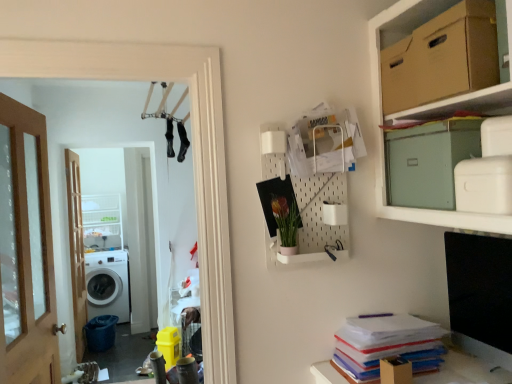
Image resolution: width=512 pixels, height=384 pixels. I want to click on matte green cardboard box at upper right, which is counted as the 1th cardboard box, starting from the bottom, so click(429, 161).

Measure the distance between brown cardboard box at upper right, arranged as the 2th cardboard box when ordered from the bottom, and camera.

brown cardboard box at upper right, arranged as the 2th cardboard box when ordered from the bottom, and camera are 4.15 feet apart.

Describe the element at coordinates (76, 250) in the screenshot. The image size is (512, 384). I see `brown wooden door at left, positioned as the first door in left-to-right order` at that location.

Measure the distance between point (78, 316) and camera.

The distance of point (78, 316) from camera is 12.55 feet.

I want to click on white glossy washing machine at left, so click(108, 284).

This screenshot has width=512, height=384. I want to click on wooden door at left, the 2th door when ordered from left to right, so click(26, 250).

Describe the element at coordinates (26, 250) in the screenshot. I see `wooden door at left, the 2th door when ordered from left to right` at that location.

What do you see at coordinates (192, 148) in the screenshot?
I see `white glossy laundry machine at left` at bounding box center [192, 148].

In order to click on matte green cardboard box at upper right, which is counted as the 1th cardboard box, starting from the bottom in this screenshot , I will do `click(429, 161)`.

Find the location of a particular element. door that is the 1st one when counting downward from the white plastic cabinet at left (from the image's perspective) is located at coordinates (26, 250).

Is wooden door at left, placed as the 1th door when sorted from front to back, far away from white plastic cabinet at left?

wooden door at left, placed as the 1th door when sorted from front to back, is far away from white plastic cabinet at left.

Is white plastic cabinet at left at the back of wooden door at left, the 1th door viewed from the right?

No, wooden door at left, the 1th door viewed from the right, is not facing the opposite direction of white plastic cabinet at left.

Which is closer, (98, 252) or (290, 227)?

Point (98, 252) is farther from the camera than point (290, 227).

Is white glossy washing machine at left bigger or smaller than green matte plant at upper center?

Clearly, white glossy washing machine at left is larger in size than green matte plant at upper center.

Can we say white glossy washing machine at left lies outside green matte plant at upper center?

That's correct, white glossy washing machine at left is outside of green matte plant at upper center.

Would you consider white glossy washing machine at left to be distant from green matte plant at upper center?

That's right, there is a large distance between white glossy washing machine at left and green matte plant at upper center.

From their relative heights in the image, would you say white plastic cabinet at left is taller or shorter than white glossy washing machine at left?

Considering their sizes, white plastic cabinet at left has less height than white glossy washing machine at left.

From a real-world perspective, relative to white glossy washing machine at left, is white plastic cabinet at left vertically above or below?

From a real-world perspective, white plastic cabinet at left is physically above white glossy washing machine at left.

At what (x,y) coordinates should I click in order to perform the action: click on washing machine that appears below the white plastic cabinet at left (from the image's perspective). Please return your answer as a coordinate pair (x, y). The image size is (512, 384). Looking at the image, I should click on (108, 284).

Does white plastic cabinet at left have a greater width compared to white glossy washing machine at left?

No.

How different are the orientations of matte green cardboard box at upper right, which is counted as the 1th cardboard box, starting from the bottom, and brown wooden door at left, placed as the 2th door when sorted from front to back, in degrees?

178 degrees.

From the image's perspective, would you say matte green cardboard box at upper right, which is the second cardboard box from top to bottom, is positioned over brown wooden door at left, placed as the 2th door when sorted from front to back?

Result: Indeed, from the image's perspective, matte green cardboard box at upper right, which is the second cardboard box from top to bottom, is shown above brown wooden door at left, placed as the 2th door when sorted from front to back.

Is matte green cardboard box at upper right, which is the second cardboard box from top to bottom, inside or outside of brown wooden door at left, positioned as the first door in left-to-right order?

matte green cardboard box at upper right, which is the second cardboard box from top to bottom, is outside brown wooden door at left, positioned as the first door in left-to-right order.

In terms of size, does matte green cardboard box at upper right, which is counted as the 1th cardboard box, starting from the bottom, appear bigger or smaller than brown wooden door at left, the 1th door when ordered from back to front?

matte green cardboard box at upper right, which is counted as the 1th cardboard box, starting from the bottom, is smaller than brown wooden door at left, the 1th door when ordered from back to front.

From the image's perspective, does white glossy laundry machine at left appear lower than brown wooden door at left, placed as the second door when sorted from right to left?

Incorrect, from the image's perspective, white glossy laundry machine at left is higher than brown wooden door at left, placed as the second door when sorted from right to left.

This screenshot has width=512, height=384. There is a white glossy laundry machine at left. In order to click on the 2nd door below it (from the image's perspective) in this screenshot , I will do `click(76, 250)`.

From a real-world perspective, relative to brown wooden door at left, the 1th door when ordered from back to front, is white glossy laundry machine at left vertically above or below?

white glossy laundry machine at left is situated higher than brown wooden door at left, the 1th door when ordered from back to front, in the real world.

Is point (113, 196) in front of point (204, 134)?

No, (113, 196) is further to viewer.

From a real-world perspective, is white plastic cabinet at left physically above white glossy laundry machine at left?

No.

Considering the relative positions of white plastic cabinet at left and white glossy laundry machine at left in the image provided, is white plastic cabinet at left to the left of white glossy laundry machine at left from the viewer's perspective?

Yes.

Could you tell me if white plastic cabinet at left is facing white glossy laundry machine at left?

Yes, white plastic cabinet at left is oriented towards white glossy laundry machine at left.

From the image's perspective, which object appears higher, white glossy washing machine at left or brown wooden door at left, placed as the 2th door when sorted from front to back?

brown wooden door at left, placed as the 2th door when sorted from front to back, from the image's perspective.

What's the angular difference between white glossy washing machine at left and brown wooden door at left, placed as the 2th door when sorted from front to back,'s facing directions?

They differ by 90 degrees in their facing directions.

Is white glossy washing machine at left closer to the viewer compared to brown wooden door at left, the 1th door when ordered from back to front?

No, the depth of white glossy washing machine at left is greater than that of brown wooden door at left, the 1th door when ordered from back to front.

From a real-world perspective, is white glossy washing machine at left located higher than brown wooden door at left, the 1th door when ordered from back to front?

No, from a real-world perspective, white glossy washing machine at left is not above brown wooden door at left, the 1th door when ordered from back to front.

Where is `cabinet lying on the left of wooden door at left, the 2th door when ordered from left to right`? cabinet lying on the left of wooden door at left, the 2th door when ordered from left to right is located at coordinates (102, 222).

Where is `plant above the white glossy washing machine at left (from the image's perspective)`? plant above the white glossy washing machine at left (from the image's perspective) is located at coordinates (286, 219).

Estimate the real-world distances between objects in this image. Which object is closer to white glossy washing machine at left, brown cardboard box at upper right, positioned as the 1th cardboard box in top-to-bottom order, or matte green cardboard box at upper right, which is counted as the 1th cardboard box, starting from the bottom?

The object closer to white glossy washing machine at left is matte green cardboard box at upper right, which is counted as the 1th cardboard box, starting from the bottom.

Which object lies further to the anchor point green matte plant at upper center, matte green cardboard box at upper right, which is counted as the 1th cardboard box, starting from the bottom, or white glossy washing machine at left?

white glossy washing machine at left is positioned further to the anchor green matte plant at upper center.

Based on their spatial positions, is matte green cardboard box at upper right, which is the second cardboard box from top to bottom, or brown cardboard box at upper right, positioned as the 1th cardboard box in top-to-bottom order, further from brown wooden door at left, placed as the second door when sorted from right to left?

Based on the image, brown cardboard box at upper right, positioned as the 1th cardboard box in top-to-bottom order, appears to be further to brown wooden door at left, placed as the second door when sorted from right to left.

Looking at this image, looking at the image, which one is located closer to brown wooden door at left, placed as the second door when sorted from right to left, white glossy laundry machine at left or wooden door at left, the second door viewed from the back?

wooden door at left, the second door viewed from the back, lies closer to brown wooden door at left, placed as the second door when sorted from right to left, than the other object.

Looking at the image, which one is located closer to matte green cardboard box at upper right, which is counted as the 1th cardboard box, starting from the bottom, white glossy washing machine at left or brown cardboard box at upper right, positioned as the 1th cardboard box in top-to-bottom order?

Among the two, brown cardboard box at upper right, positioned as the 1th cardboard box in top-to-bottom order, is located nearer to matte green cardboard box at upper right, which is counted as the 1th cardboard box, starting from the bottom.

Based on their spatial positions, is green matte plant at upper center or white glossy laundry machine at left closer to matte green cardboard box at upper right, which is the second cardboard box from top to bottom?

Among the two, green matte plant at upper center is located nearer to matte green cardboard box at upper right, which is the second cardboard box from top to bottom.

Which object lies nearer to the anchor point brown cardboard box at upper right, arranged as the 2th cardboard box when ordered from the bottom, brown wooden door at left, placed as the 2th door when sorted from front to back, or white plastic cabinet at left?

Based on the image, brown wooden door at left, placed as the 2th door when sorted from front to back, appears to be nearer to brown cardboard box at upper right, arranged as the 2th cardboard box when ordered from the bottom.

Considering their positions, is brown cardboard box at upper right, arranged as the 2th cardboard box when ordered from the bottom, positioned further to white glossy washing machine at left than wooden door at left, the 2th door when ordered from left to right?

The object further to white glossy washing machine at left is brown cardboard box at upper right, arranged as the 2th cardboard box when ordered from the bottom.

Locate an element on the screen. Image resolution: width=512 pixels, height=384 pixels. door located between green matte plant at upper center and white glossy washing machine at left in the depth direction is located at coordinates (76, 250).

The image size is (512, 384). In order to click on plant between white glossy laundry machine at left and white plastic cabinet at left along the z-axis in this screenshot , I will do `click(286, 219)`.

This screenshot has width=512, height=384. Identify the location of washing machine between brown wooden door at left, placed as the second door when sorted from right to left, and white plastic cabinet at left from front to back. (108, 284).

Where is `door between matte green cardboard box at upper right, which is the second cardboard box from top to bottom, and brown wooden door at left, positioned as the first door in left-to-right order, along the z-axis`? Image resolution: width=512 pixels, height=384 pixels. door between matte green cardboard box at upper right, which is the second cardboard box from top to bottom, and brown wooden door at left, positioned as the first door in left-to-right order, along the z-axis is located at coordinates (26, 250).